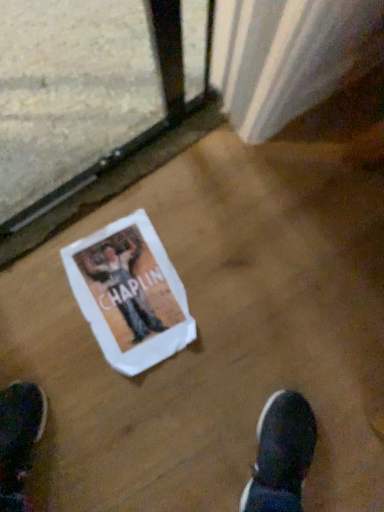
What are the coordinates of `vacant area on top of white paper flyer at center (from a real-world perspective)` in the screenshot? It's located at (128, 298).